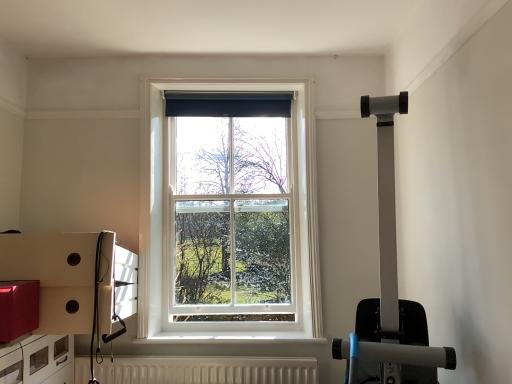
Question: Looking at their shapes, would you say white textured radiator at lower center is wider or thinner than white wooden window at center?

Choices:
 (A) wide
 (B) thin

Answer: (A)

Question: In the image, is white textured radiator at lower center on the left side or the right side of white wooden window at center?

Choices:
 (A) right
 (B) left

Answer: (B)

Question: Which is nearer to the white textured radiator at lower center?

Choices:
 (A) matte white drawer at lower left
 (B) white wooden window at center

Answer: (A)

Question: Estimate the real-world distances between objects in this image. Which object is farther from the white textured radiator at lower center?

Choices:
 (A) matte white drawer at lower left
 (B) white wooden window at center

Answer: (B)